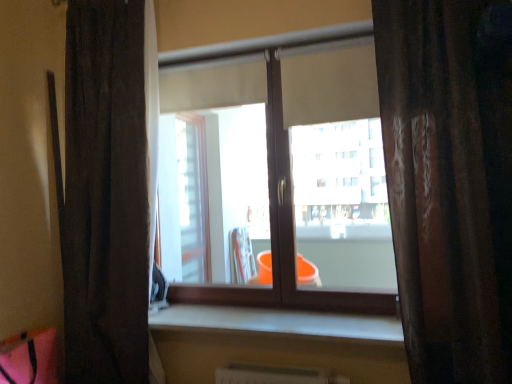
Question: Considering the relative sizes of dark fabric curtain at left, the 1th curtain viewed from the left, and brown textured curtain at right, the first curtain from the front, in the image provided, is dark fabric curtain at left, the 1th curtain viewed from the left, thinner than brown textured curtain at right, the first curtain from the front,?

Choices:
 (A) yes
 (B) no

Answer: (A)

Question: From the image's perspective, is dark fabric curtain at left, the 2th curtain in the right-to-left sequence, on brown textured curtain at right, the first curtain from the front?

Choices:
 (A) no
 (B) yes

Answer: (A)

Question: Does dark fabric curtain at left, which ranks as the second curtain in front-to-back order, have a larger size compared to brown textured curtain at right, the second curtain when ordered from left to right?

Choices:
 (A) no
 (B) yes

Answer: (A)

Question: Is there a large distance between dark fabric curtain at left, placed as the 1th curtain when sorted from back to front, and brown textured curtain at right, arranged as the 2th curtain when viewed from the back?

Choices:
 (A) no
 (B) yes

Answer: (B)

Question: From a real-world perspective, is dark fabric curtain at left, which ranks as the second curtain in front-to-back order, below brown textured curtain at right, the first curtain from the front?

Choices:
 (A) yes
 (B) no

Answer: (B)

Question: From the image's perspective, is smooth concrete window sill at center positioned above or below dark fabric curtain at left, the 2th curtain in the right-to-left sequence?

Choices:
 (A) below
 (B) above

Answer: (A)

Question: Is point (233, 329) closer or farther from the camera than point (117, 268)?

Choices:
 (A) closer
 (B) farther

Answer: (A)

Question: Is smooth concrete window sill at center bigger or smaller than dark fabric curtain at left, which ranks as the second curtain in front-to-back order?

Choices:
 (A) big
 (B) small

Answer: (B)

Question: From a real-world perspective, is smooth concrete window sill at center physically located above or below dark fabric curtain at left, which ranks as the second curtain in front-to-back order?

Choices:
 (A) above
 (B) below

Answer: (B)

Question: Considering the positions of dark fabric curtain at left, which ranks as the second curtain in front-to-back order, and smooth concrete window sill at center in the image, is dark fabric curtain at left, which ranks as the second curtain in front-to-back order, taller or shorter than smooth concrete window sill at center?

Choices:
 (A) tall
 (B) short

Answer: (A)

Question: Relative to smooth concrete window sill at center, is dark fabric curtain at left, placed as the 1th curtain when sorted from back to front, in front or behind?

Choices:
 (A) behind
 (B) front

Answer: (A)

Question: From a real-world perspective, relative to smooth concrete window sill at center, is dark fabric curtain at left, placed as the 1th curtain when sorted from back to front, vertically above or below?

Choices:
 (A) above
 (B) below

Answer: (A)

Question: In terms of size, does dark fabric curtain at left, which ranks as the second curtain in front-to-back order, appear bigger or smaller than smooth concrete window sill at center?

Choices:
 (A) big
 (B) small

Answer: (A)

Question: In terms of height, does transparent glass window at center look taller or shorter compared to smooth concrete window sill at center?

Choices:
 (A) tall
 (B) short

Answer: (A)

Question: Considering their positions, is transparent glass window at center located in front of or behind smooth concrete window sill at center?

Choices:
 (A) front
 (B) behind

Answer: (B)